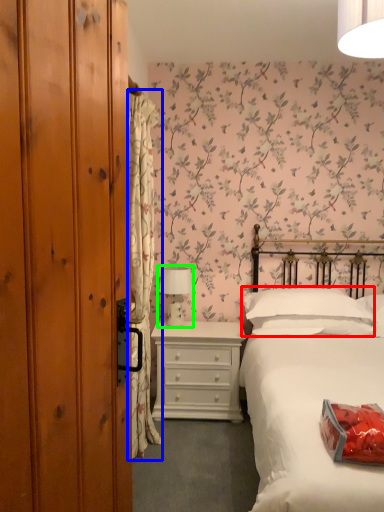
Question: Based on their relative distances, which object is nearer to pillow (highlighted by a red box)? Choose from curtain (highlighted by a blue box) and table lamp (highlighted by a green box).

Choices:
 (A) curtain
 (B) table lamp

Answer: (B)